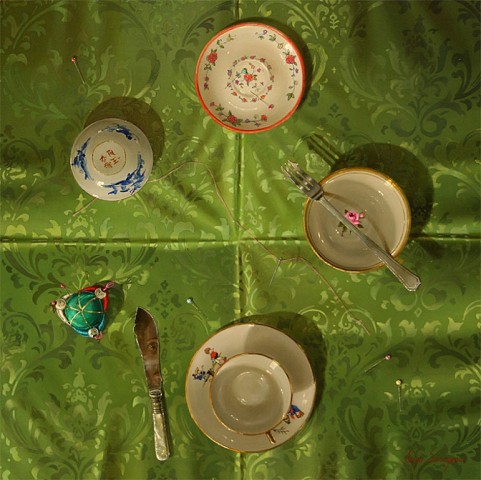
Find the location of a particular element. This screenshot has width=481, height=480. red rim of saucer is located at coordinates (440, 325), (304, 67).